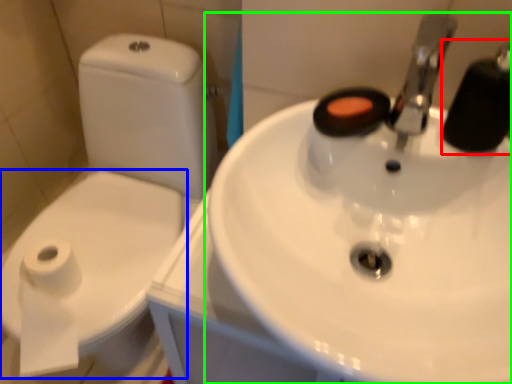
Question: Which object is positioned farthest from plumbing fixture (highlighted by a red box)? Select from bidet (highlighted by a blue box) and sink (highlighted by a green box).

Choices:
 (A) bidet
 (B) sink

Answer: (A)